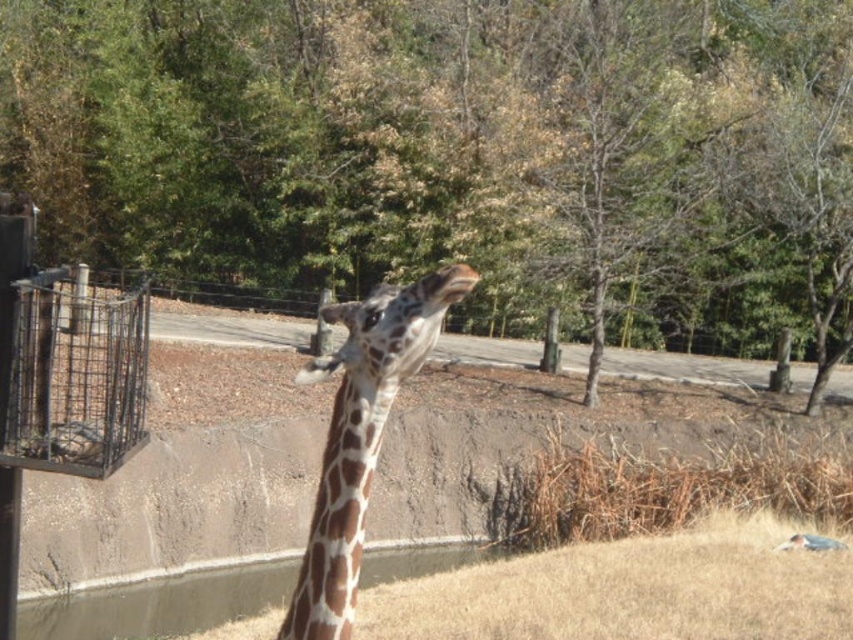
Does metal wire bird feeder at left have a lesser height compared to spotted fur head at center?

No.

Which is more to the left, metal wire bird feeder at left or spotted fur head at center?

metal wire bird feeder at left is more to the left.

Does point (20, 314) lie behind point (350, 346)?

Yes.

The image size is (853, 640). Find the location of `metal wire bird feeder at left`. metal wire bird feeder at left is located at coordinates (76, 376).

Who is positioned more to the right, spotted fur head at center or metal wire basket at left?

Positioned to the right is spotted fur head at center.

Where is `spotted fur head at center`? The image size is (853, 640). spotted fur head at center is located at coordinates (392, 328).

I want to click on spotted fur head at center, so click(x=392, y=328).

Can you confirm if green leafy tree at upper center is bigger than spotted fur head at center?

A: Correct, green leafy tree at upper center is larger in size than spotted fur head at center.

Between point (473, 99) and point (337, 360), which one is positioned behind?

The point (473, 99) is behind.

This screenshot has height=640, width=853. I want to click on green leafy tree at upper center, so pyautogui.click(x=456, y=150).